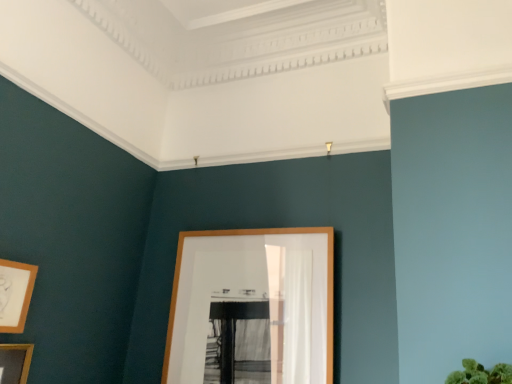
Question: Considering the relative sizes of wooden picture frame at lower left, acting as the 3th picture frame starting from the right, and wooden picture frame at lower left, which ranks as the 2th picture frame in left-to-right order, in the image provided, is wooden picture frame at lower left, acting as the 3th picture frame starting from the right, shorter than wooden picture frame at lower left, which ranks as the 2th picture frame in left-to-right order,?

Choices:
 (A) no
 (B) yes

Answer: (A)

Question: Is wooden picture frame at lower left, which ranks as the 1th picture frame in left-to-right order, further to camera compared to wooden picture frame at lower left, the 2th picture frame when ordered from right to left?

Choices:
 (A) no
 (B) yes

Answer: (A)

Question: From a real-world perspective, is wooden picture frame at lower left, acting as the 3th picture frame starting from the right, positioned over wooden picture frame at lower left, the 2th picture frame when ordered from right to left, based on gravity?

Choices:
 (A) no
 (B) yes

Answer: (A)

Question: From the image's perspective, would you say wooden picture frame at lower left, which ranks as the 1th picture frame in left-to-right order, is shown under wooden picture frame at lower left, the 2th picture frame when ordered from right to left?

Choices:
 (A) no
 (B) yes

Answer: (B)

Question: Is wooden picture frame at lower left, which ranks as the 1th picture frame in left-to-right order, beside wooden picture frame at lower left, which ranks as the 2th picture frame in left-to-right order?

Choices:
 (A) no
 (B) yes

Answer: (A)

Question: In terms of width, does wooden picture frame at center, positioned as the third picture frame in left-to-right order, look wider or thinner when compared to wooden picture frame at lower left, acting as the 3th picture frame starting from the right?

Choices:
 (A) thin
 (B) wide

Answer: (B)

Question: In terms of height, does wooden picture frame at center, the 1th picture frame positioned from the right, look taller or shorter compared to wooden picture frame at lower left, acting as the 3th picture frame starting from the right?

Choices:
 (A) short
 (B) tall

Answer: (B)

Question: From the image's perspective, is wooden picture frame at center, the 1th picture frame positioned from the right, located above or below wooden picture frame at lower left, which ranks as the 1th picture frame in left-to-right order?

Choices:
 (A) below
 (B) above

Answer: (B)

Question: Looking at the image, does wooden picture frame at center, the 1th picture frame positioned from the right, seem bigger or smaller compared to wooden picture frame at lower left, acting as the 3th picture frame starting from the right?

Choices:
 (A) small
 (B) big

Answer: (B)

Question: Based on their positions, is wooden picture frame at lower left, which ranks as the 1th picture frame in left-to-right order, located to the left or right of wooden picture frame at center, the 1th picture frame positioned from the right?

Choices:
 (A) right
 (B) left

Answer: (B)

Question: In terms of height, does wooden picture frame at lower left, acting as the 3th picture frame starting from the right, look taller or shorter compared to wooden picture frame at center, the 1th picture frame positioned from the right?

Choices:
 (A) tall
 (B) short

Answer: (B)

Question: Does point pos(7,382) appear closer or farther from the camera than point pos(318,360)?

Choices:
 (A) farther
 (B) closer

Answer: (B)

Question: In the image, is wooden picture frame at lower left, acting as the 3th picture frame starting from the right, positioned in front of or behind wooden picture frame at center, positioned as the third picture frame in left-to-right order?

Choices:
 (A) front
 (B) behind

Answer: (A)

Question: Does point (19, 306) appear closer or farther from the camera than point (221, 291)?

Choices:
 (A) farther
 (B) closer

Answer: (B)

Question: From the image's perspective, is wooden picture frame at lower left, which ranks as the 2th picture frame in left-to-right order, located above or below wooden picture frame at center, the 1th picture frame positioned from the right?

Choices:
 (A) above
 (B) below

Answer: (A)